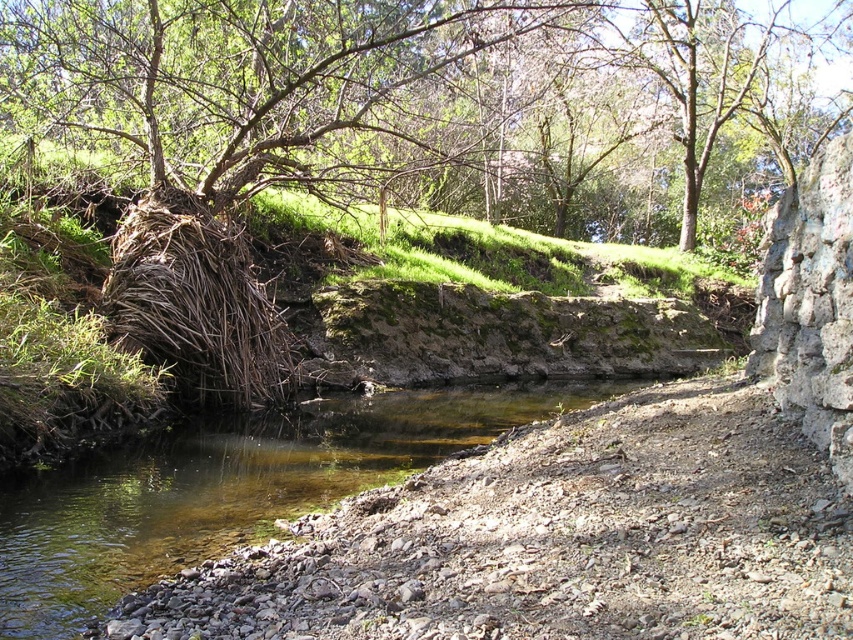
You are a painter setting up your easel to capture the scene. You want to include both the green leafy tree at upper left and the clear water at bottom left in your painting. Which object should you position closer to the center of your canvas to ensure both are visible without overcrowding?

The clear water at bottom left is narrower than the green leafy tree at upper left, so positioning the green leafy tree at upper left closer to the center would allow both to fit without overcrowding.

You are standing at the center of the image. Which direction should you look to see the green leafy tree at upper left?

The green leafy tree at upper left is located at point (399, 88), so you should look to the upper left direction to see it.

You are planning to build a small wooden bridge over the stream. The bridge needs to connect the stone wall on the right to a point near the clear water at bottom left. However, there is a green leafy tree at upper left in the way. Based on their positions, can the bridge be built without cutting down the tree?

The green leafy tree at upper left is located above the clear water at bottom left. Since the tree is positioned above the water where the bridge would need to be constructed, it might obstruct the path. Therefore, the bridge cannot be built without removing or adjusting the tree.